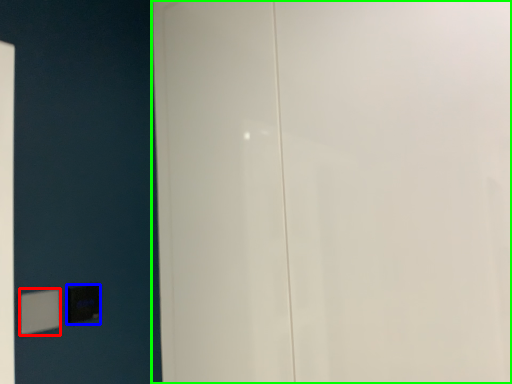
Question: Which object is positioned farthest from light switch (highlighted by a red box)? Select from light switch (highlighted by a blue box) and door (highlighted by a green box).

Choices:
 (A) light switch
 (B) door

Answer: (B)